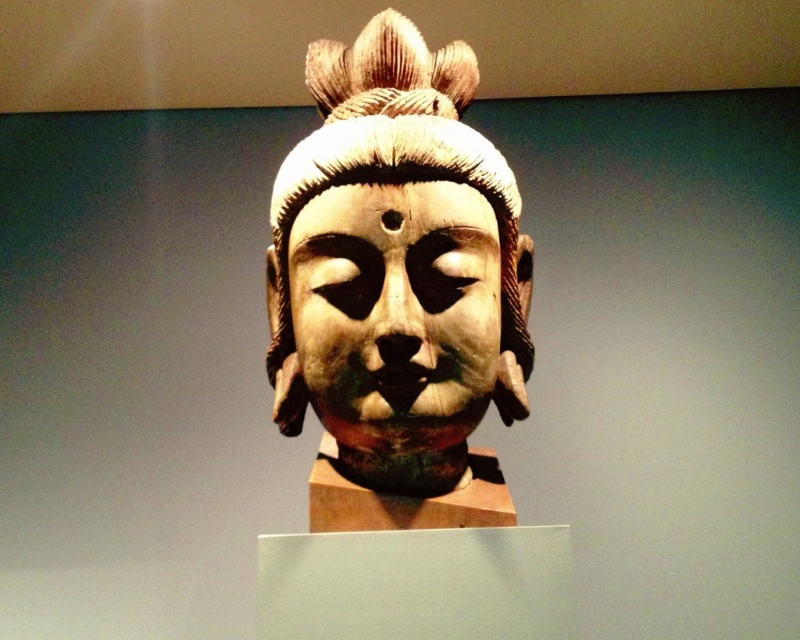
You are an art conservator examining the wooden sculpture. You notice two central elements, the matte wood mask at center and the wooden textured headdress at center. Which of these two elements is shorter in height?

The matte wood mask at center has a lesser height compared to the wooden textured headdress at center, so the matte wood mask at center is shorter in height.

You are an art conservator examining the wooden statue at center and the wooden textured headdress at center. Which object has a greater width according to the description?

The wooden statue at center has a greater width than the wooden textured headdress at center.

You are an art conservator examining the sculpture. You notice that the matte wood mask at center and the wooden textured headdress at center are positioned in a way that might affect their exposure to light. Which object is positioned closer to the front of the sculpture?

The matte wood mask at center is closer to the viewer than the wooden textured headdress at center, so it is positioned closer to the front of the sculpture.